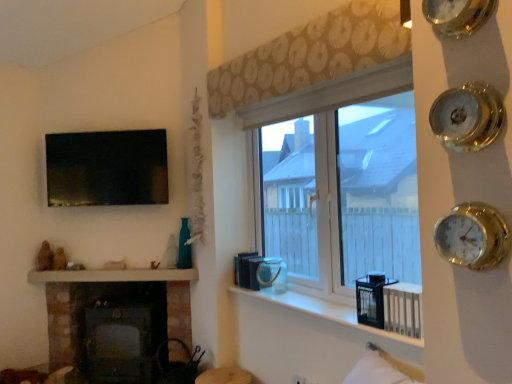
Question: Can you confirm if matte black tv at upper left is wider than white glossy window sill at center?

Choices:
 (A) no
 (B) yes

Answer: (A)

Question: Are matte black tv at upper left and white glossy window sill at center far apart?

Choices:
 (A) no
 (B) yes

Answer: (B)

Question: From a real-world perspective, is matte black tv at upper left positioned over white glossy window sill at center based on gravity?

Choices:
 (A) no
 (B) yes

Answer: (B)

Question: Considering the relative sizes of matte black tv at upper left and white glossy window sill at center in the image provided, is matte black tv at upper left taller than white glossy window sill at center?

Choices:
 (A) no
 (B) yes

Answer: (B)

Question: From a real-world perspective, does matte black tv at upper left sit lower than white glossy window sill at center?

Choices:
 (A) no
 (B) yes

Answer: (A)

Question: Considering the relative positions of matte black tv at upper left and white glossy window sill at center in the image provided, is matte black tv at upper left to the right of white glossy window sill at center from the viewer's perspective?

Choices:
 (A) no
 (B) yes

Answer: (A)

Question: Is white glossy window sill at center to the left of clear glass window at center from the viewer's perspective?

Choices:
 (A) yes
 (B) no

Answer: (A)

Question: Can you confirm if white glossy window sill at center is smaller than clear glass window at center?

Choices:
 (A) yes
 (B) no

Answer: (A)

Question: Can clear glass window at center be found inside white glossy window sill at center?

Choices:
 (A) no
 (B) yes

Answer: (A)

Question: From the image's perspective, is white glossy window sill at center under clear glass window at center?

Choices:
 (A) no
 (B) yes

Answer: (B)

Question: Is white glossy window sill at center taller than clear glass window at center?

Choices:
 (A) yes
 (B) no

Answer: (B)

Question: Considering the relative sizes of white glossy window sill at center and clear glass window at center in the image provided, is white glossy window sill at center bigger than clear glass window at center?

Choices:
 (A) no
 (B) yes

Answer: (A)

Question: Can you confirm if white glossy mantle at lower left is thinner than beige patterned curtain at upper center?

Choices:
 (A) no
 (B) yes

Answer: (A)